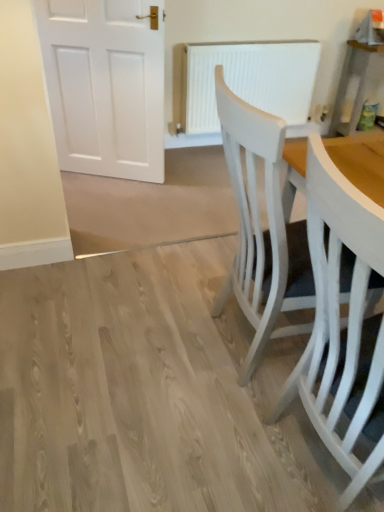
At what (x,y) coordinates should I click in order to perform the action: click on vacant space that is to the left of white painted wood chair at right, which is the first chair in front-to-back order. Please return your answer as a coordinate pair (x, y). Image resolution: width=384 pixels, height=512 pixels. Looking at the image, I should click on (189, 435).